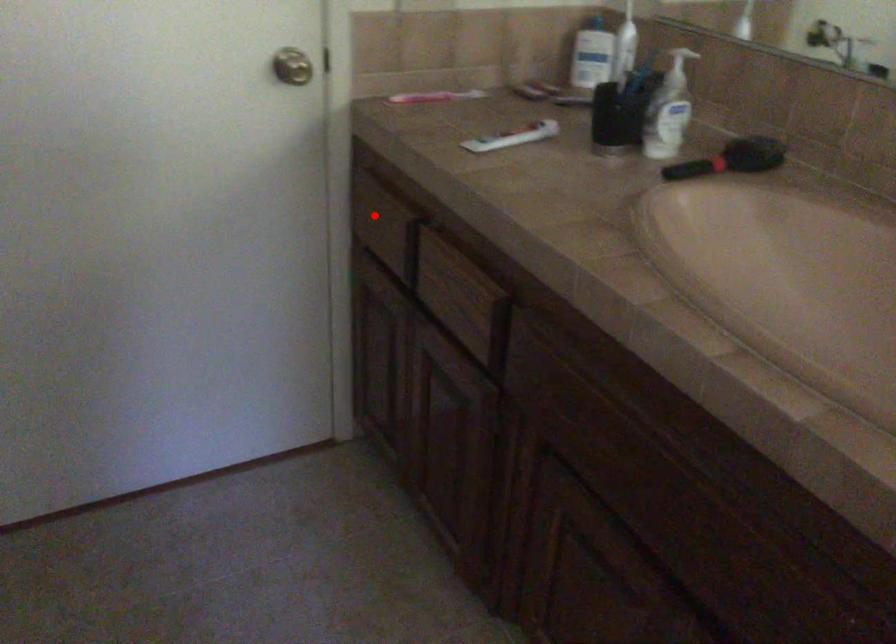
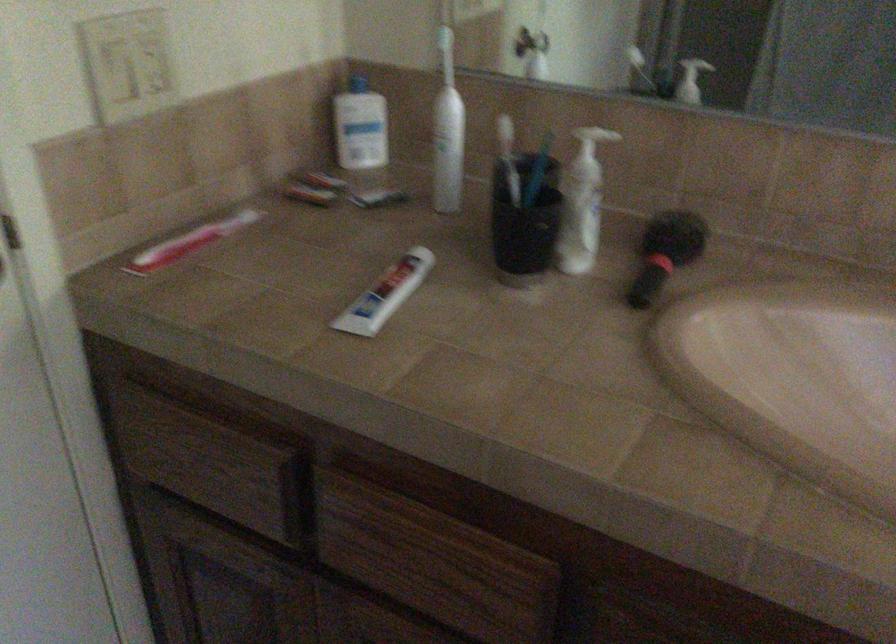
Locate, in the second image, the point that corresponds to the highlighted location in the first image.

(195, 456)